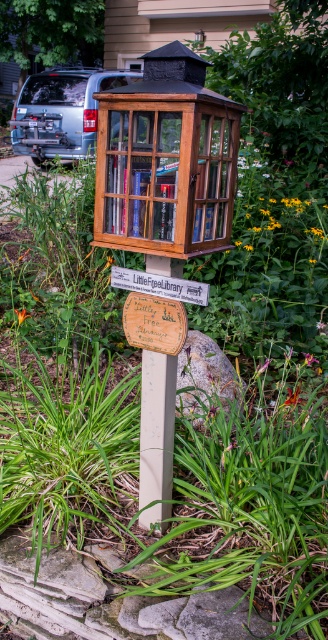
You are standing in front of the Little Free Library and want to reach a book located at point (134, 141). If your arm can extend 5 feet, can you reach it?

The point (134, 141) is 6.51 feet from the viewer, which is farther than your arm can extend 5 feet. So you cannot reach it.

You are a gardener who wants to place a new decorative item between the wooden birdhouse at center and the purple matte flower at center. Which object should you place the item closer to if you want it to be closer to the smaller object?

The purple matte flower at center is smaller than the wooden birdhouse at center. Therefore, placing the new decorative item closer to the purple matte flower at center would position it nearer to the smaller object.